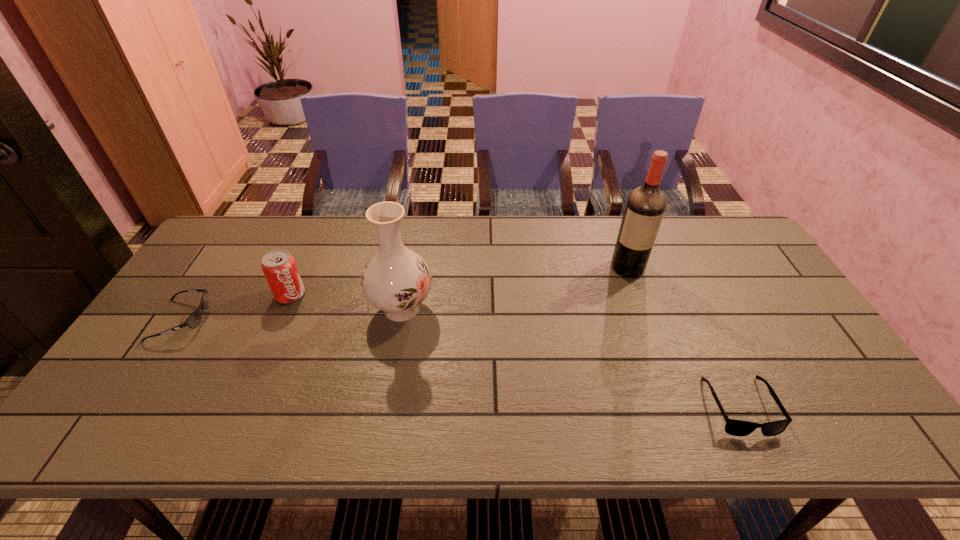
Locate an element on the screen. The height and width of the screenshot is (540, 960). liquor is located at coordinates (645, 206).

Where is `the tallest object`? This screenshot has height=540, width=960. the tallest object is located at coordinates (645, 206).

Where is `vase`? The image size is (960, 540). vase is located at coordinates (396, 280).

You are a GUI agent. You are given a task and a screenshot of the screen. Output one action in this format:
    pyautogui.click(x=<x>, y=<y>)
    Task: Click on the third object from right to left
    This screenshot has height=540, width=960.
    Given the screenshot: What is the action you would take?
    pyautogui.click(x=396, y=280)

At what (x,y) coordinates should I click in order to perform the action: click on soda can. Please return your answer as a coordinate pair (x, y). Image resolution: width=960 pixels, height=540 pixels. Looking at the image, I should click on (279, 267).

Identify the location of the third tallest object. (279, 267).

Locate an element on the screen. the farther sunglasses is located at coordinates (193, 321).

I want to click on the leftmost object, so click(x=193, y=321).

I want to click on the nearer sunglasses, so click(x=733, y=427).

Where is `the right sunglasses`? Image resolution: width=960 pixels, height=540 pixels. the right sunglasses is located at coordinates (733, 427).